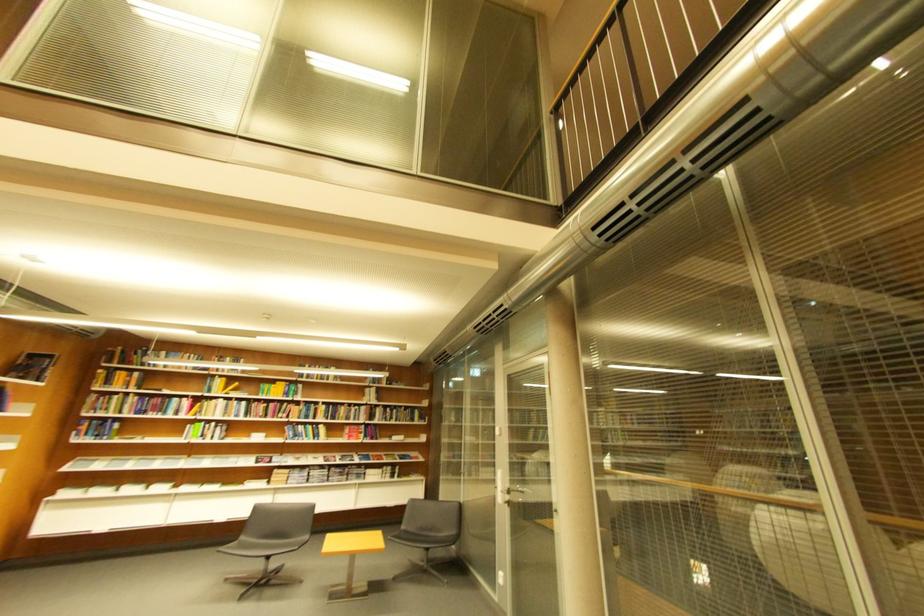
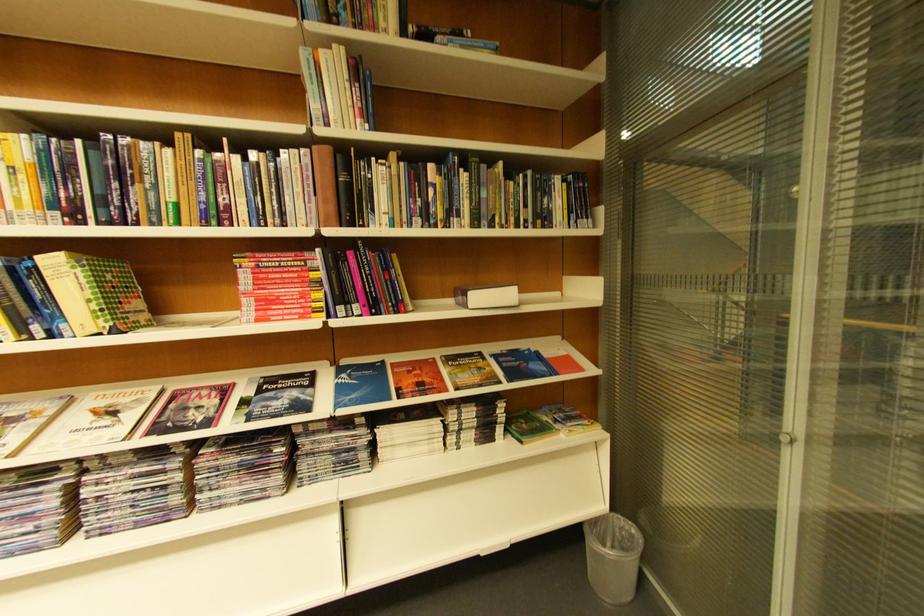
In the second image, find the point that corresponds to the point at 392,386 in the first image.

(384, 31)